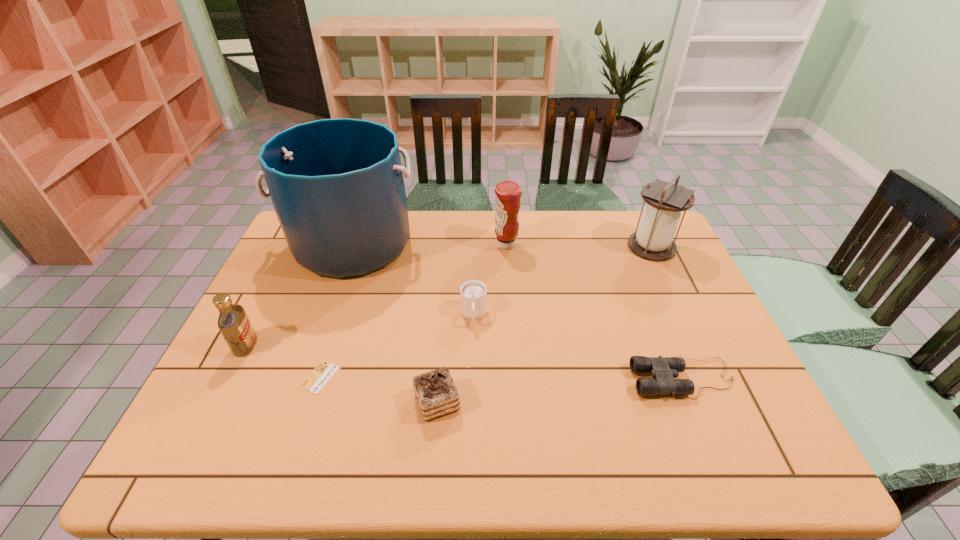
The width and height of the screenshot is (960, 540). What are the coordinates of `vacant space at the left edge of the desktop` in the screenshot? It's located at (266, 358).

In the image, there is a desktop. Identify the location of free space at the right edge. The height and width of the screenshot is (540, 960). (690, 275).

Image resolution: width=960 pixels, height=540 pixels. I want to click on free location at the far right corner, so pos(612,210).

Where is `vacant space that's between the bucket and the fourth tallest object`? The width and height of the screenshot is (960, 540). vacant space that's between the bucket and the fourth tallest object is located at coordinates (299, 295).

The height and width of the screenshot is (540, 960). I want to click on blank region between the fourth tallest object and the fourth farthest object, so click(x=360, y=330).

You are a GUI agent. You are given a task and a screenshot of the screen. Output one action in this format:
    pyautogui.click(x=<x>, y=<y>)
    Task: Click on the vacant area that lies between the lantern and the chocolate cake
    The width and height of the screenshot is (960, 540).
    Given the screenshot: What is the action you would take?
    pyautogui.click(x=544, y=325)

Where is `vacant area that lies between the lantern and the shortest object`? vacant area that lies between the lantern and the shortest object is located at coordinates (486, 312).

At what (x,y) coordinates should I click in order to perform the action: click on vacant space in between the shortest object and the binoculars. Please return your answer as a coordinate pair (x, y). This screenshot has height=540, width=960. Looking at the image, I should click on (502, 378).

The height and width of the screenshot is (540, 960). In order to click on free spot between the sixth object from left to right and the lantern in this screenshot , I will do `click(579, 246)`.

Identify the location of vacant space that's between the identity card and the cappuccino. (397, 346).